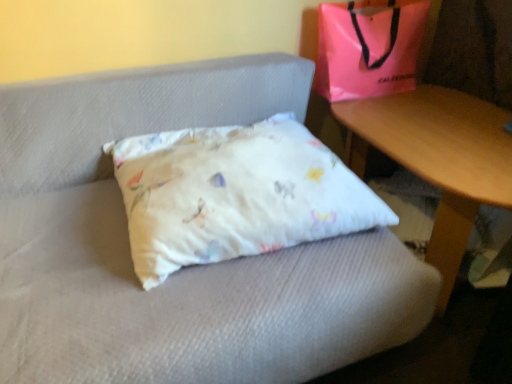
Question: From a real-world perspective, relative to wooden table at lower right, is pink plastic bag at upper right vertically above or below?

Choices:
 (A) above
 (B) below

Answer: (A)

Question: Considering their positions, is pink plastic bag at upper right located in front of or behind wooden table at lower right?

Choices:
 (A) behind
 (B) front

Answer: (A)

Question: Estimate the real-world distances between objects in this image. Which object is closer to the white cotton pillow at center?

Choices:
 (A) pink plastic bag at upper right
 (B) wooden table at lower right

Answer: (B)

Question: Which is nearer to the wooden table at lower right?

Choices:
 (A) white cotton pillow at center
 (B) pink plastic bag at upper right

Answer: (B)